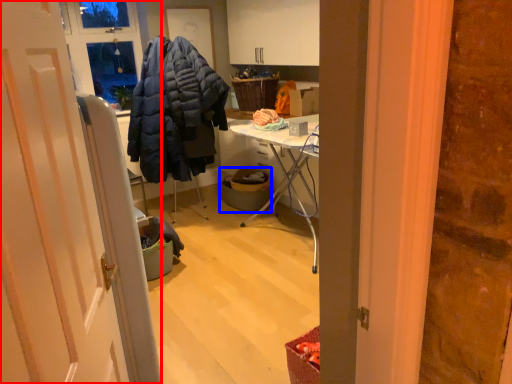
Question: Among these objects, which one is nearest to the camera, door (highlighted by a red box) or trash bin/can (highlighted by a blue box)?

Choices:
 (A) door
 (B) trash bin/can

Answer: (A)